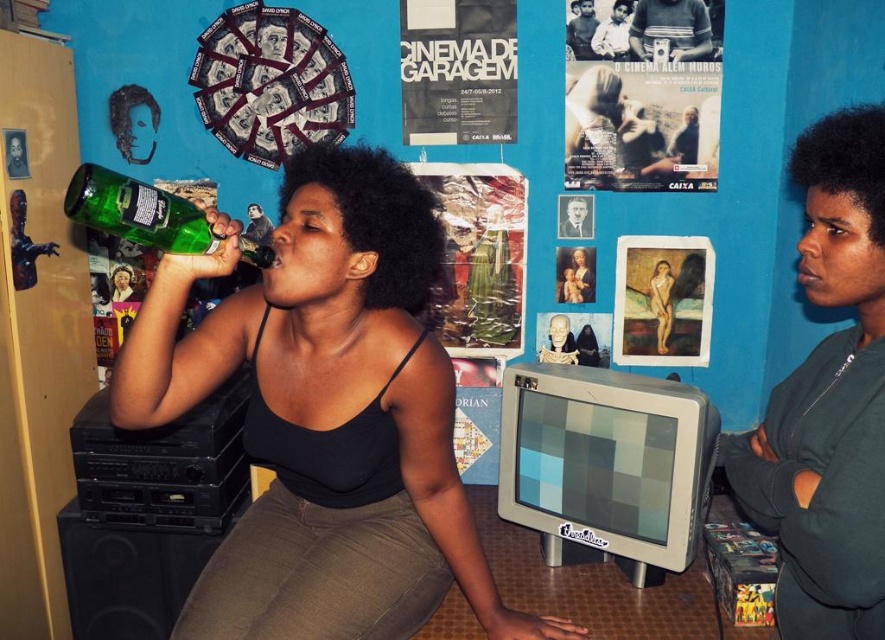
Question: Which point is farther from the camera taking this photo?

Choices:
 (A) (118, 298)
 (B) (618, 4)
 (C) (648, 307)

Answer: (A)

Question: Which of the following is the closest to the observer?

Choices:
 (A) green glass bottle at left
 (B) green glass bottle at upper left

Answer: (A)

Question: Does green glass bottle at left come in front of smooth plastic bottle at upper left?

Choices:
 (A) no
 (B) yes

Answer: (B)

Question: Among these objects, which one is farthest from the camera?

Choices:
 (A) smooth skin nude at center
 (B) striped fabric camera at upper center
 (C) matte paper poster at upper center
 (D) smooth beige skull at center

Answer: (D)

Question: Is light brown wooden chair at upper center to the left of smooth plastic bottle at upper left from the viewer's perspective?

Choices:
 (A) no
 (B) yes

Answer: (A)

Question: Is matte paper poster at upper center positioned in front of black paper portrait at upper center?

Choices:
 (A) yes
 (B) no

Answer: (A)